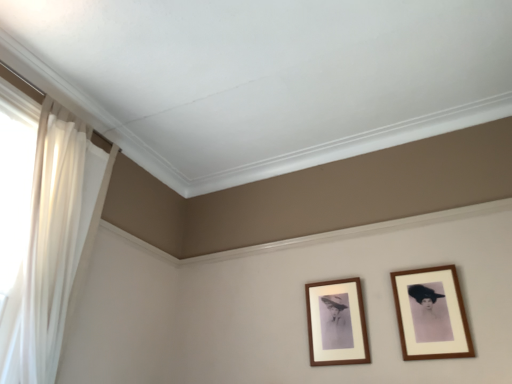
Question: From the image's perspective, is wooden frame at center, the second picture frame when ordered from right to left, under wooden frame at right, which is counted as the second picture frame, starting from the left?

Choices:
 (A) no
 (B) yes

Answer: (B)

Question: Can you see wooden frame at center, arranged as the 1th picture frame when viewed from the left, touching wooden frame at right, which is the first picture frame from right to left?

Choices:
 (A) no
 (B) yes

Answer: (A)

Question: From a real-world perspective, is wooden frame at center, arranged as the 1th picture frame when viewed from the left, on wooden frame at right, which is counted as the second picture frame, starting from the left?

Choices:
 (A) yes
 (B) no

Answer: (A)

Question: Can you confirm if wooden frame at center, arranged as the 1th picture frame when viewed from the left, is smaller than wooden frame at right, which is counted as the second picture frame, starting from the left?

Choices:
 (A) no
 (B) yes

Answer: (B)

Question: Can you confirm if wooden frame at center, the second picture frame when ordered from right to left, is shorter than wooden frame at right, which is the first picture frame from right to left?

Choices:
 (A) no
 (B) yes

Answer: (A)

Question: From a real-world perspective, is white sheer curtain at left above or below wooden frame at right, which is counted as the second picture frame, starting from the left?

Choices:
 (A) above
 (B) below

Answer: (A)

Question: From the image's perspective, relative to wooden frame at right, which is counted as the second picture frame, starting from the left, is white sheer curtain at left above or below?

Choices:
 (A) below
 (B) above

Answer: (B)

Question: Does point (64, 243) appear closer or farther from the camera than point (433, 269)?

Choices:
 (A) farther
 (B) closer

Answer: (B)

Question: Looking at the image, does white sheer curtain at left seem bigger or smaller compared to wooden frame at right, which is counted as the second picture frame, starting from the left?

Choices:
 (A) small
 (B) big

Answer: (B)

Question: Do you think wooden frame at right, which is counted as the second picture frame, starting from the left, is within wooden frame at center, arranged as the 1th picture frame when viewed from the left, or outside of it?

Choices:
 (A) inside
 (B) outside

Answer: (B)

Question: From the image's perspective, is wooden frame at right, which is the first picture frame from right to left, located above or below wooden frame at center, arranged as the 1th picture frame when viewed from the left?

Choices:
 (A) above
 (B) below

Answer: (A)

Question: From their relative heights in the image, would you say wooden frame at right, which is counted as the second picture frame, starting from the left, is taller or shorter than wooden frame at center, arranged as the 1th picture frame when viewed from the left?

Choices:
 (A) tall
 (B) short

Answer: (B)

Question: Is point (467, 337) positioned closer to the camera than point (331, 357)?

Choices:
 (A) farther
 (B) closer

Answer: (B)

Question: Considering the relative positions of wooden frame at center, the second picture frame when ordered from right to left, and wooden frame at right, which is the first picture frame from right to left, in the image provided, is wooden frame at center, the second picture frame when ordered from right to left, to the left or to the right of wooden frame at right, which is the first picture frame from right to left,?

Choices:
 (A) left
 (B) right

Answer: (A)

Question: Would you say wooden frame at center, arranged as the 1th picture frame when viewed from the left, is inside or outside wooden frame at right, which is counted as the second picture frame, starting from the left?

Choices:
 (A) outside
 (B) inside

Answer: (A)